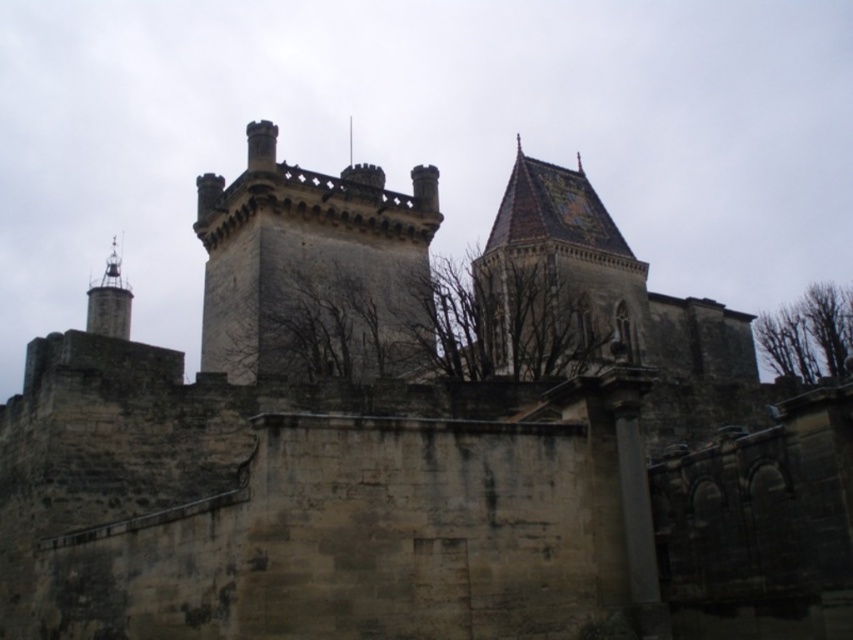
Question: Does brown tiled roof at upper center appear on the left side of bare branches at upper right?

Choices:
 (A) no
 (B) yes

Answer: (B)

Question: Can you confirm if dark gray stone tower at center is wider than bare branches at upper right?

Choices:
 (A) no
 (B) yes

Answer: (A)

Question: Is dark gray stone tower at center below brown tiled roof at upper center?

Choices:
 (A) yes
 (B) no

Answer: (B)

Question: Which of the following is the farthest from the observer?

Choices:
 (A) (300, 333)
 (B) (589, 221)

Answer: (B)

Question: Which point is closer to the camera?

Choices:
 (A) (810, 305)
 (B) (358, 285)
 (C) (235, 259)

Answer: (B)

Question: Which of the following is the farthest from the observer?

Choices:
 (A) (624, 296)
 (B) (425, 332)
 (C) (311, 202)

Answer: (A)